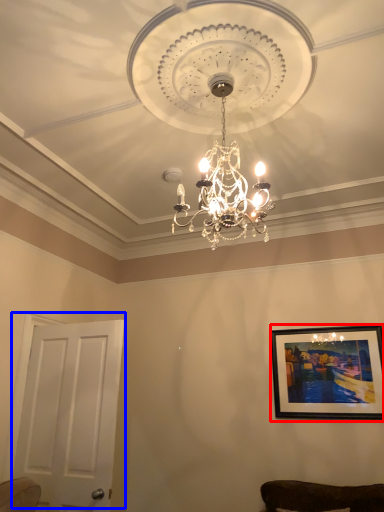
Question: Which object appears farthest to the camera in this image, picture frame (highlighted by a red box) or door (highlighted by a blue box)?

Choices:
 (A) picture frame
 (B) door

Answer: (A)